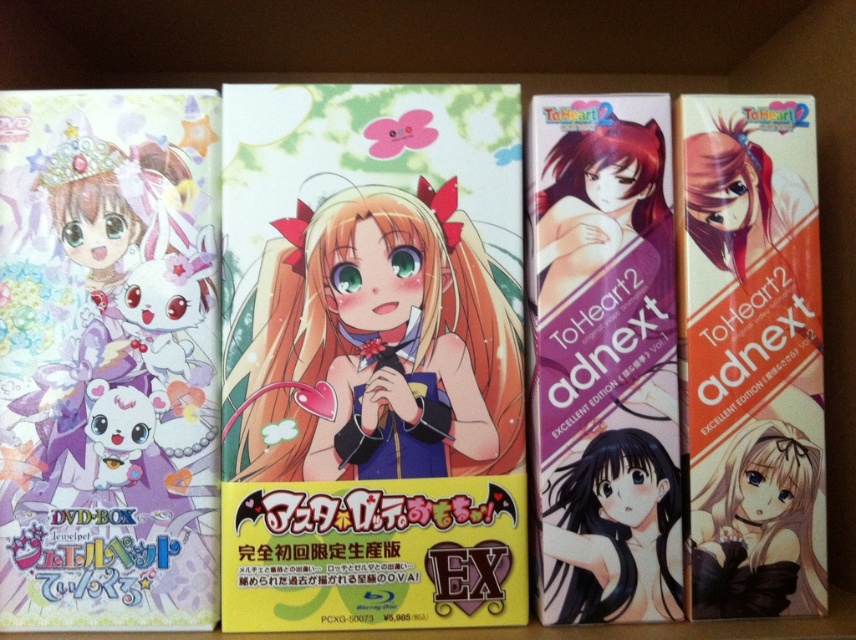
You are organizing DVDs on a shelf and need to place the orange matte book at right and the black glossy hair at center. According to the image, which one should be placed to the right side of the other?

The orange matte book at right should be placed to the right of the black glossy hair at center because the description states that the orange matte book at right is to the right of the black glossy hair at center.

You are designing a display for these DVD boxes and need to know the relative sizes of the elements on the leftmost box. Specifically, how does the width of the pastel matte card at center compare to the smooth brown hair at center?

The pastel matte card at center is wider than the smooth brown hair at center.

You are organizing DVDs on a shelf and need to place the orange matte book at right. According to the image, where should you place it?

The orange matte book at right should be placed at the position with coordinates point (750, 355).